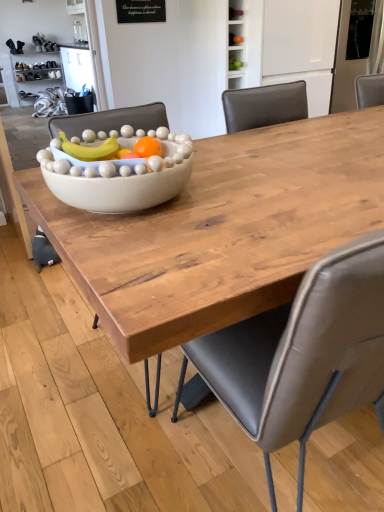
Question: From a real-world perspective, is white glossy bowl at center positioned under matte wood bowl at center based on gravity?

Choices:
 (A) yes
 (B) no

Answer: (B)

Question: Is white glossy bowl at center touching matte wood bowl at center?

Choices:
 (A) yes
 (B) no

Answer: (B)

Question: Is white glossy bowl at center wider than matte wood bowl at center?

Choices:
 (A) no
 (B) yes

Answer: (A)

Question: Considering the relative positions of white glossy bowl at center and matte wood bowl at center in the image provided, is white glossy bowl at center behind matte wood bowl at center?

Choices:
 (A) yes
 (B) no

Answer: (A)

Question: Is there a large distance between white glossy bowl at center and matte wood bowl at center?

Choices:
 (A) yes
 (B) no

Answer: (B)

Question: Considering the positions of white glossy bowl at center and matte wood bowl at center in the image, is white glossy bowl at center taller or shorter than matte wood bowl at center?

Choices:
 (A) short
 (B) tall

Answer: (A)

Question: From a real-world perspective, relative to matte wood bowl at center, is white glossy bowl at center vertically above or below?

Choices:
 (A) above
 (B) below

Answer: (A)

Question: From the image's perspective, is white glossy bowl at center positioned above or below matte wood bowl at center?

Choices:
 (A) below
 (B) above

Answer: (B)

Question: Is white glossy bowl at center to the left or to the right of matte wood bowl at center in the image?

Choices:
 (A) right
 (B) left

Answer: (B)

Question: In terms of height, does matte wood bowl at center look taller or shorter compared to white glossy bowl at center?

Choices:
 (A) short
 (B) tall

Answer: (B)

Question: Is matte wood bowl at center in front of or behind white glossy bowl at center in the image?

Choices:
 (A) front
 (B) behind

Answer: (A)

Question: Is matte wood bowl at center inside the boundaries of white glossy bowl at center, or outside?

Choices:
 (A) inside
 (B) outside

Answer: (B)

Question: Is matte wood bowl at center bigger or smaller than white glossy bowl at center?

Choices:
 (A) small
 (B) big

Answer: (B)

Question: Considering the positions of white glossy bowl at center and gray leather chair at center in the image, is white glossy bowl at center wider or thinner than gray leather chair at center?

Choices:
 (A) wide
 (B) thin

Answer: (B)

Question: From a real-world perspective, is white glossy bowl at center above or below gray leather chair at center?

Choices:
 (A) above
 (B) below

Answer: (A)